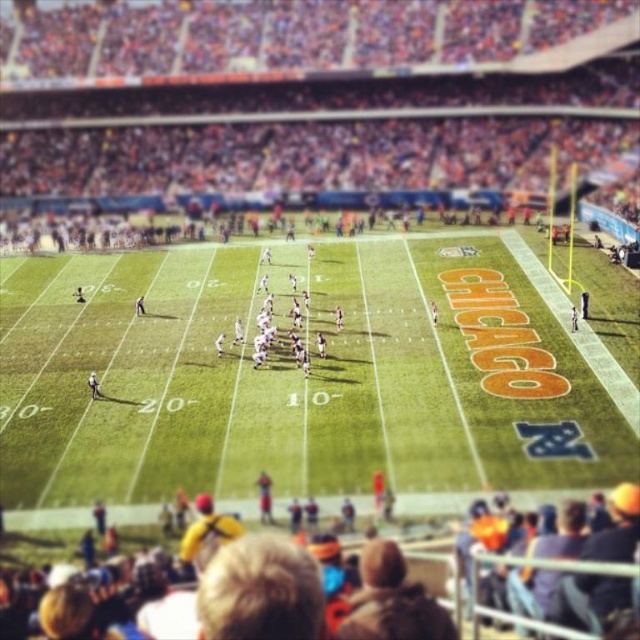
Is green grass field at center smaller than multicolored fabric crowd at lower center?

Incorrect, green grass field at center is not smaller in size than multicolored fabric crowd at lower center.

Who is taller, green grass field at center or multicolored fabric crowd at lower center?

With more height is green grass field at center.

I want to click on green grass field at center, so click(301, 374).

Who is more forward, (538, 316) or (300, 349)?

Positioned in front is point (300, 349).

Describe the element at coordinates (301, 374) in the screenshot. I see `green grass field at center` at that location.

Between point (109, 308) and point (268, 326), which one is positioned behind?

Positioned behind is point (109, 308).

This screenshot has width=640, height=640. What are the coordinates of `green grass field at center` in the screenshot? It's located at (301, 374).

Can you confirm if multicolored fabric crowd at lower center is thinner than white matte football team at center?

No.

Does multicolored fabric crowd at lower center appear on the left side of white matte football team at center?

No, multicolored fabric crowd at lower center is not to the left of white matte football team at center.

Identify the location of multicolored fabric crowd at lower center. (294, 596).